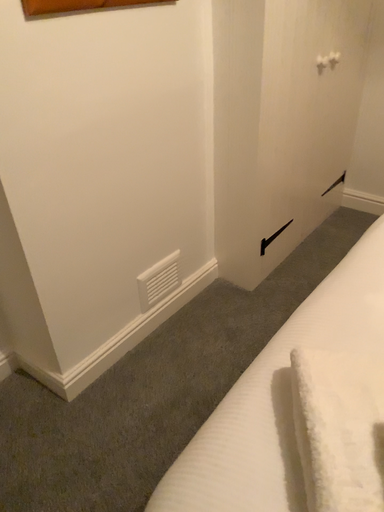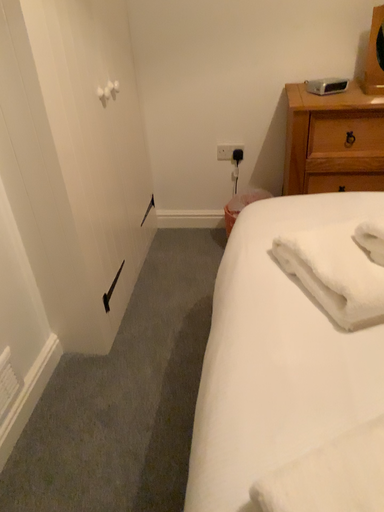
Question: Which way did the camera rotate in the video?

Choices:
 (A) rotated right
 (B) rotated left

Answer: (A)